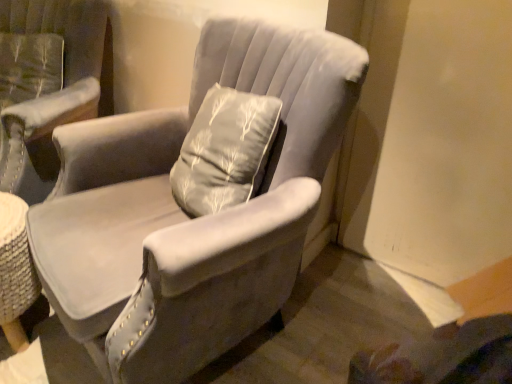
Question: From the image's perspective, is velvet gray armchair at center, positioned as the 1th chair in right-to-left order, positioned above or below velvet gray armchair at upper left, the 2th chair from the right?

Choices:
 (A) above
 (B) below

Answer: (B)

Question: Does point (124, 354) appear closer or farther from the camera than point (24, 104)?

Choices:
 (A) farther
 (B) closer

Answer: (B)

Question: Choose the correct answer: Is velvet gray armchair at center, positioned as the 1th chair in right-to-left order, inside velvet gray armchair at upper left, the 2th chair from the right, or outside it?

Choices:
 (A) outside
 (B) inside

Answer: (A)

Question: In the image, is velvet gray armchair at upper left, the 2th chair from the right, on the left side or the right side of velvet gray armchair at center, positioned as the 1th chair in right-to-left order?

Choices:
 (A) left
 (B) right

Answer: (A)

Question: Does point (59, 11) appear closer or farther from the camera than point (72, 278)?

Choices:
 (A) farther
 (B) closer

Answer: (A)

Question: Considering the positions of velvet gray armchair at upper left, the 2th chair from the right, and velvet gray armchair at center, arranged as the 2th chair when viewed from the left, in the image, is velvet gray armchair at upper left, the 2th chair from the right, wider or thinner than velvet gray armchair at center, arranged as the 2th chair when viewed from the left,?

Choices:
 (A) thin
 (B) wide

Answer: (A)

Question: Based on their sizes in the image, would you say velvet gray armchair at upper left, the 2th chair from the right, is bigger or smaller than velvet gray armchair at center, arranged as the 2th chair when viewed from the left?

Choices:
 (A) small
 (B) big

Answer: (A)